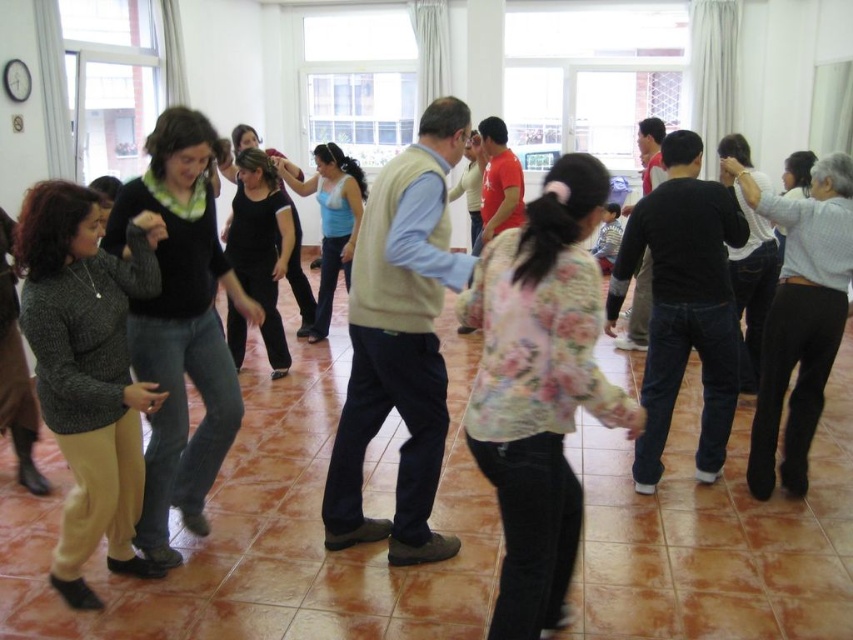
Question: Is matte black sweater at center below black cotton shirt at center?

Choices:
 (A) yes
 (B) no

Answer: (A)

Question: In this image, where is light beige vest at center located relative to light blue jersey at center?

Choices:
 (A) right
 (B) left

Answer: (A)

Question: Estimate the real-world distances between objects in this image. Which object is farther from the white striped shirt at right?

Choices:
 (A) light beige vest at center
 (B) black cotton shirt at center

Answer: (A)

Question: Is light beige vest at center below matte black sweater at center?

Choices:
 (A) no
 (B) yes

Answer: (B)

Question: Which object is closer to the camera taking this photo?

Choices:
 (A) black cotton shirt at center
 (B) matte black sweater at center
 (C) light blue jersey at center

Answer: (B)

Question: Which object is farther from the camera taking this photo?

Choices:
 (A) knitted gray sweater at left
 (B) light blue jersey at center
 (C) black cotton shirt at center
 (D) floral print blouse at center

Answer: (B)